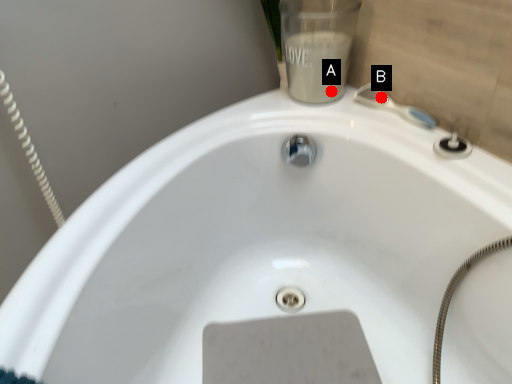
Question: Two points are circled on the image, labeled by A and B beside each circle. Which point is closer to the camera?

Choices:
 (A) A is closer
 (B) B is closer

Answer: (B)